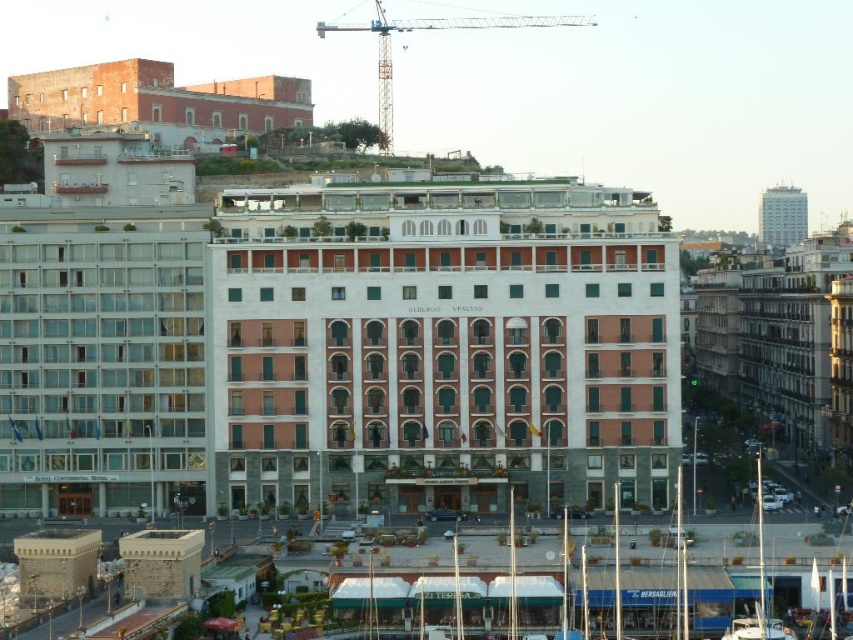
You are standing in the plaza in front of the red brick building at center and the brick wall building at upper left. Which building is closer to you?

The red brick building at center is closer to you because it is in front of the brick wall building at upper left, meaning the latter is further away.

In the scene shown: You are standing in the plaza in front of the building and want to walk to both the point at coordinates point (601, 236) and the point at coordinates point (128, 125). Which point will you reach first if you start walking straight from your current position?

You will reach the point at coordinates point (601, 236) first because it is closer to you than the point at coordinates point (128, 125).

You are standing at the point labeled point (424,227) in the image. You want to take a photo of the entire building without any obstructions. Is the camera positioned far enough away to capture the entire structure in one shot?

The distance between point (424,227) and the camera is 125.84 meters. Since the camera is positioned 125.84 meters away from the point, it should be far enough to capture the entire building in one shot without any obstructions.